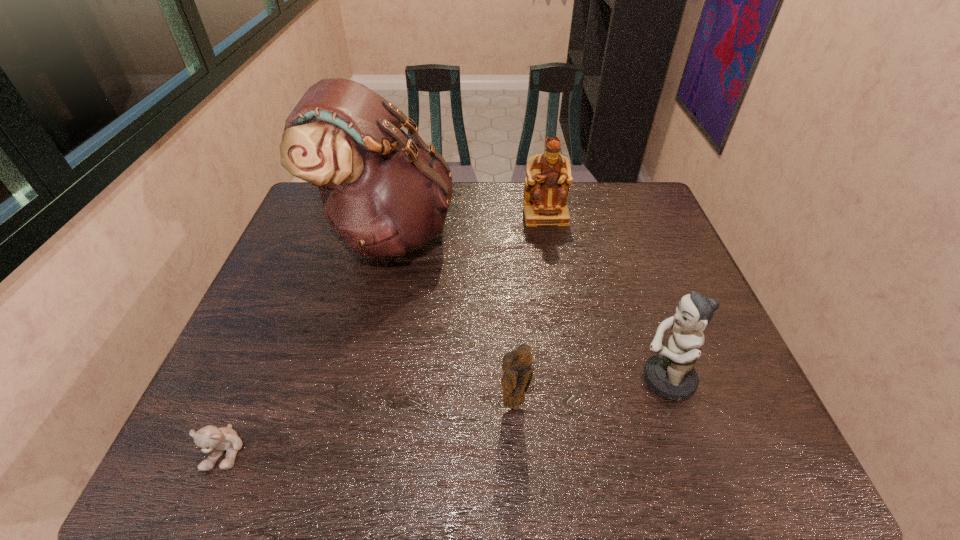
At what (x,y) coordinates should I click in order to perform the action: click on the tallest object. Please return your answer as a coordinate pair (x, y). The height and width of the screenshot is (540, 960). Looking at the image, I should click on (384, 193).

Where is `the farthest figurine`? This screenshot has width=960, height=540. the farthest figurine is located at coordinates (546, 189).

This screenshot has width=960, height=540. I want to click on the fourth object from left to right, so tap(546, 189).

Locate an element on the screen. the rightmost object is located at coordinates (670, 374).

The image size is (960, 540). Identify the location of the third object from left to right. (517, 365).

The width and height of the screenshot is (960, 540). What are the coordinates of `the second shortest object` in the screenshot? It's located at (517, 365).

Identify the location of teddy bear. The width and height of the screenshot is (960, 540). (211, 439).

Identify the location of the nearest object. The image size is (960, 540). (211, 439).

The image size is (960, 540). In order to click on vacant area located 0.350m at the front of the satchel with buckles in this screenshot , I will do `click(567, 233)`.

What are the coordinates of `vacant area situated 0.170m on the front-facing side of the second figurine from right to left` in the screenshot? It's located at (554, 262).